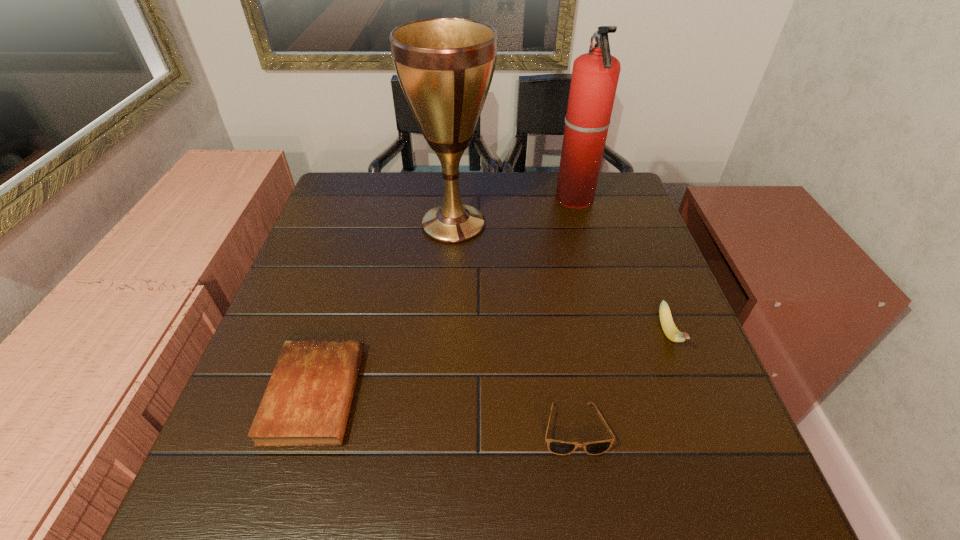
This screenshot has height=540, width=960. In order to click on free space at the near edge in this screenshot , I will do `click(502, 487)`.

The height and width of the screenshot is (540, 960). What are the coordinates of `vacant position at the left edge of the desktop` in the screenshot? It's located at point(248,381).

Locate an element on the screen. free space at the right edge of the desktop is located at coordinates (632, 300).

You are a GUI agent. You are given a task and a screenshot of the screen. Output one action in this format:
    pyautogui.click(x=<x>, y=<y>)
    Task: Click on the vacant space at the far left corner of the desktop
    
    Given the screenshot: What is the action you would take?
    pyautogui.click(x=323, y=213)

The image size is (960, 540). In the image, there is a desktop. In order to click on vacant space at the near left corner in this screenshot , I will do `click(230, 505)`.

Where is `free space at the far right corner of the desktop`? The image size is (960, 540). free space at the far right corner of the desktop is located at coordinates (615, 185).

Where is `free space between the leftmost object and the fire extinguisher`? free space between the leftmost object and the fire extinguisher is located at coordinates (444, 296).

You are a GUI agent. You are given a task and a screenshot of the screen. Output one action in this format:
    pyautogui.click(x=<x>, y=<y>)
    Task: Click on the free space between the fire extinguisher and the sunglasses
    
    Given the screenshot: What is the action you would take?
    pyautogui.click(x=574, y=314)

Locate an element on the screen. unoccupied area between the fourth object from right to left and the Bible is located at coordinates click(x=384, y=309).

Locate an element on the screen. free space between the rightmost object and the sunglasses is located at coordinates (621, 381).